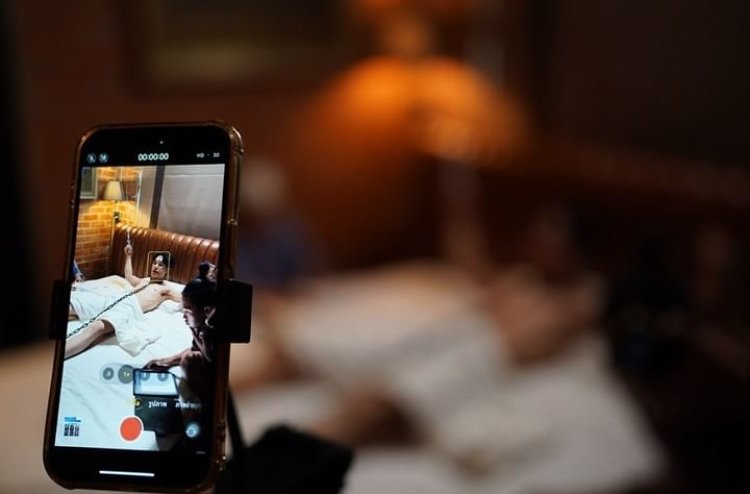
This screenshot has width=750, height=494. Find the location of `brick wall`. brick wall is located at coordinates (96, 237), (86, 86).